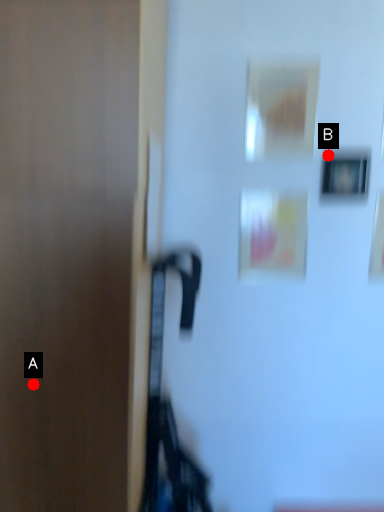
Question: Two points are circled on the image, labeled by A and B beside each circle. Which point is further to the camera?

Choices:
 (A) A is further
 (B) B is further

Answer: (B)